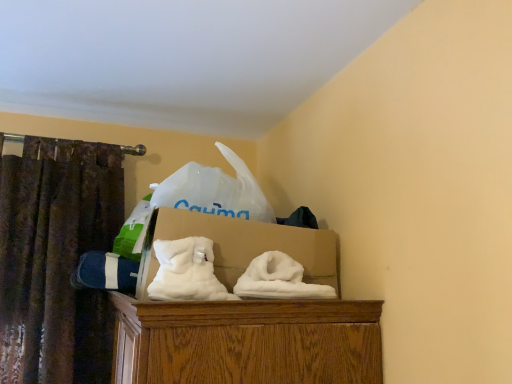
Question: Considering the positions of white cardboard box at center and brown textured curtain at left in the image, is white cardboard box at center bigger or smaller than brown textured curtain at left?

Choices:
 (A) big
 (B) small

Answer: (B)

Question: Visually, is white cardboard box at center positioned to the left or to the right of brown textured curtain at left?

Choices:
 (A) left
 (B) right

Answer: (B)

Question: In terms of height, does white cardboard box at center look taller or shorter compared to brown textured curtain at left?

Choices:
 (A) short
 (B) tall

Answer: (A)

Question: Relative to white cardboard box at center, is brown textured curtain at left in front or behind?

Choices:
 (A) behind
 (B) front

Answer: (A)

Question: Considering the relative positions of brown textured curtain at left and white cardboard box at center in the image provided, is brown textured curtain at left to the left or to the right of white cardboard box at center?

Choices:
 (A) left
 (B) right

Answer: (A)

Question: Does point click(x=5, y=182) appear closer or farther from the camera than point click(x=274, y=241)?

Choices:
 (A) closer
 (B) farther

Answer: (B)

Question: Is brown textured curtain at left taller or shorter than white cardboard box at center?

Choices:
 (A) short
 (B) tall

Answer: (B)